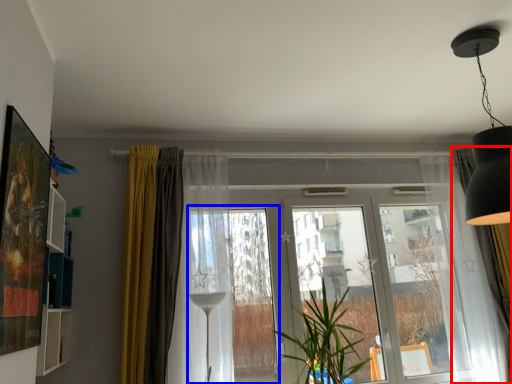
Question: Among these objects, which one is farthest to the camera, curtain (highlighted by a red box) or window frame (highlighted by a blue box)?

Choices:
 (A) curtain
 (B) window frame

Answer: (A)